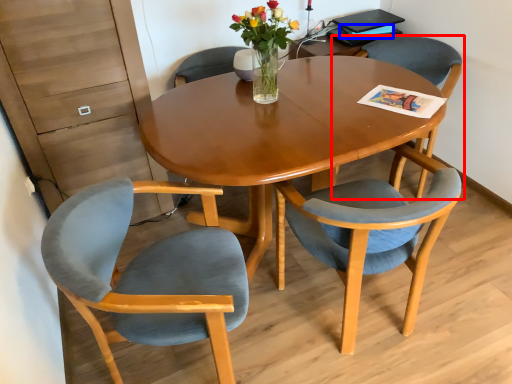
Question: Which point is closer to the camera, chair (highlighted by a red box) or magazine (highlighted by a blue box)?

Choices:
 (A) chair
 (B) magazine

Answer: (A)